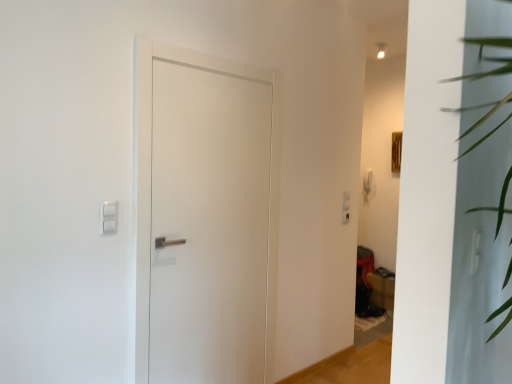
Question: Is matte brown cardboard box at lower right far away from white plastic light switch at upper left?

Choices:
 (A) yes
 (B) no

Answer: (A)

Question: Can you confirm if matte brown cardboard box at lower right is taller than white plastic light switch at upper left?

Choices:
 (A) no
 (B) yes

Answer: (B)

Question: Can you confirm if matte brown cardboard box at lower right is shorter than white plastic light switch at upper left?

Choices:
 (A) yes
 (B) no

Answer: (B)

Question: Considering the relative sizes of matte brown cardboard box at lower right and white plastic light switch at upper left in the image provided, is matte brown cardboard box at lower right smaller than white plastic light switch at upper left?

Choices:
 (A) yes
 (B) no

Answer: (B)

Question: From a real-world perspective, is matte brown cardboard box at lower right located higher than white plastic light switch at upper left?

Choices:
 (A) yes
 (B) no

Answer: (B)

Question: Can you confirm if matte brown cardboard box at lower right is thinner than white plastic light switch at upper left?

Choices:
 (A) yes
 (B) no

Answer: (B)

Question: From a real-world perspective, does matte brown cardboard box at lower right stand above white matte door at center?

Choices:
 (A) no
 (B) yes

Answer: (A)

Question: From the image's perspective, does matte brown cardboard box at lower right appear higher than white matte door at center?

Choices:
 (A) yes
 (B) no

Answer: (B)

Question: Does matte brown cardboard box at lower right have a lesser width compared to white matte door at center?

Choices:
 (A) no
 (B) yes

Answer: (A)

Question: Can you confirm if matte brown cardboard box at lower right is bigger than white matte door at center?

Choices:
 (A) yes
 (B) no

Answer: (B)

Question: Is matte brown cardboard box at lower right positioned with its back to white matte door at center?

Choices:
 (A) no
 (B) yes

Answer: (A)

Question: Can you see matte brown cardboard box at lower right touching white matte door at center?

Choices:
 (A) yes
 (B) no

Answer: (B)

Question: Is white matte door at center oriented away from white plastic light switch at upper left?

Choices:
 (A) yes
 (B) no

Answer: (B)